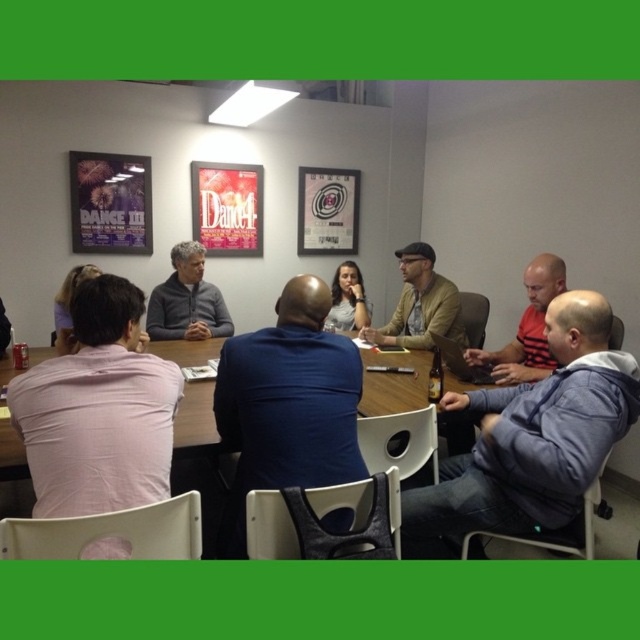
Question: Is dark blue sweater at center bigger than brown leather jacket at center?

Choices:
 (A) yes
 (B) no

Answer: (B)

Question: Is brown leather jacket at center wider than gray fleece jacket at center?

Choices:
 (A) yes
 (B) no

Answer: (A)

Question: Which of these objects is positioned closest to the gray fleece jacket at center?

Choices:
 (A) pink cotton shirt at left
 (B) dark blue sweater at center
 (C) blue fleece jacket at lower right

Answer: (B)

Question: Which is farther from the pink cotton shirt at left?

Choices:
 (A) brown leather jacket at center
 (B) gray fleece jacket at center
 (C) dark blue sweater at center
 (D) blue fleece jacket at lower right

Answer: (B)

Question: Which is farther from the pink cotton shirt at left?

Choices:
 (A) dark blue sweater at center
 (B) blue fleece jacket at lower right
 (C) gray fleece jacket at center

Answer: (C)

Question: Is blue fleece jacket at lower right positioned at the back of dark blue sweater at center?

Choices:
 (A) no
 (B) yes

Answer: (A)